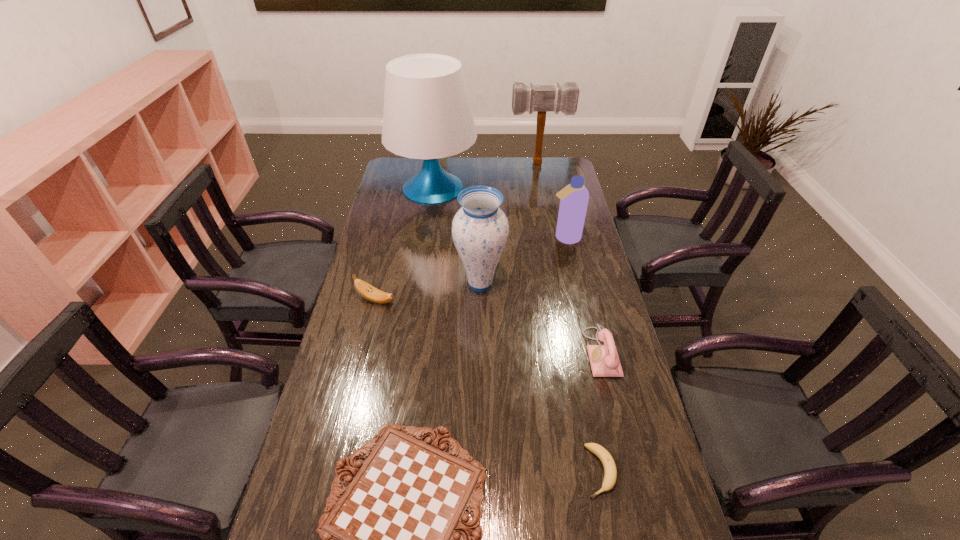
Where is `vacant space positioned on the front-facing side of the tallest object`? The width and height of the screenshot is (960, 540). vacant space positioned on the front-facing side of the tallest object is located at coordinates (421, 276).

Where is `free spot located 0.190m on the left of the mallet`? The width and height of the screenshot is (960, 540). free spot located 0.190m on the left of the mallet is located at coordinates (470, 164).

This screenshot has width=960, height=540. Find the location of `vacant space located 0.390m on the front of the vase`. vacant space located 0.390m on the front of the vase is located at coordinates (480, 406).

Find the location of a particular element. The width and height of the screenshot is (960, 540). vacant region located 0.140m on the back of the third farthest object is located at coordinates (559, 210).

Image resolution: width=960 pixels, height=540 pixels. Identify the location of blank space located 0.210m on the dial of the third nearest object. (516, 352).

At what (x,y) coordinates should I click in order to perform the action: click on vacant space located 0.230m on the dial of the third nearest object. Please return your answer as a coordinate pair (x, y). The image size is (960, 540). Looking at the image, I should click on (510, 352).

Locate an element on the screen. vacant space located on the dial of the third nearest object is located at coordinates (566, 352).

Locate an element on the screen. Image resolution: width=960 pixels, height=540 pixels. vacant area situated 0.340m on the front of the taller banana is located at coordinates (352, 398).

Locate an element on the screen. vacant space located at the stem of the shorter banana is located at coordinates (612, 528).

Locate an element on the screen. Image resolution: width=960 pixels, height=540 pixels. table lamp that is positioned at the far edge is located at coordinates (427, 115).